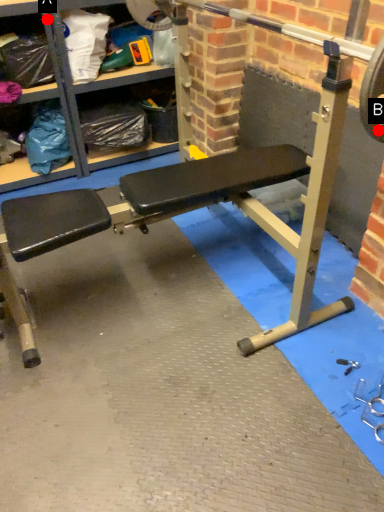
Question: Two points are circled on the image, labeled by A and B beside each circle. Which point is closer to the camera?

Choices:
 (A) A is closer
 (B) B is closer

Answer: (B)